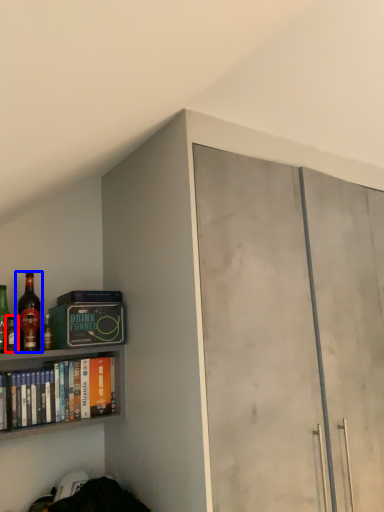
Question: Which point is closer to the camera, bottle (highlighted by a red box) or bottle (highlighted by a blue box)?

Choices:
 (A) bottle
 (B) bottle

Answer: (A)